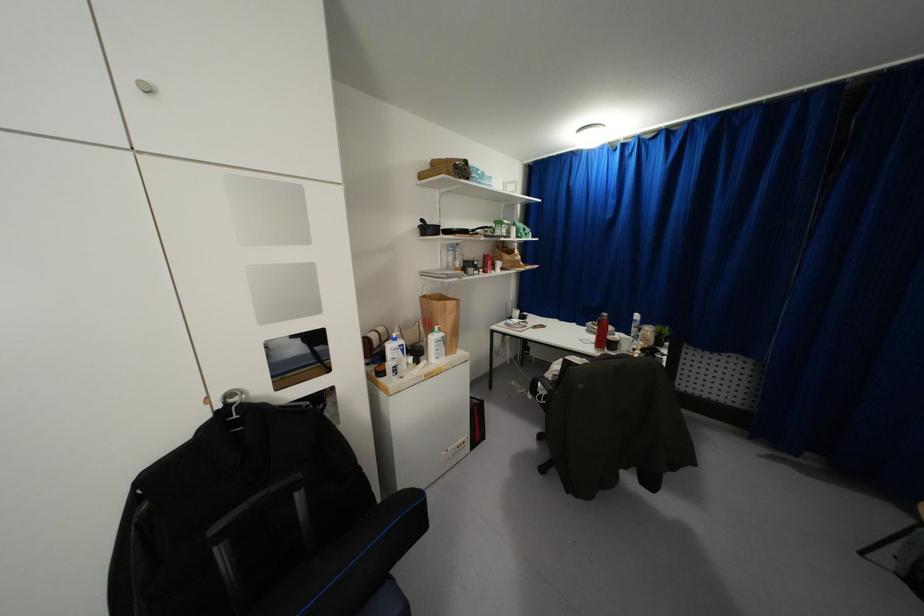
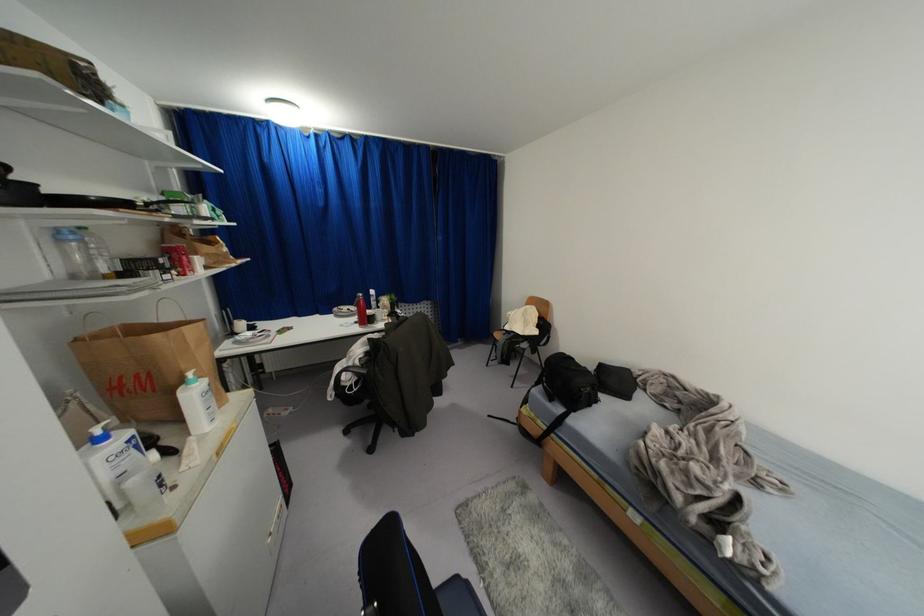
Question: The camera is either moving clockwise (left) or counter-clockwise (right) around the object. The first image is from the beginning of the video and the second image is from the end. Is the camera moving left or right when shooting the video?

Choices:
 (A) Left
 (B) Right

Answer: (A)